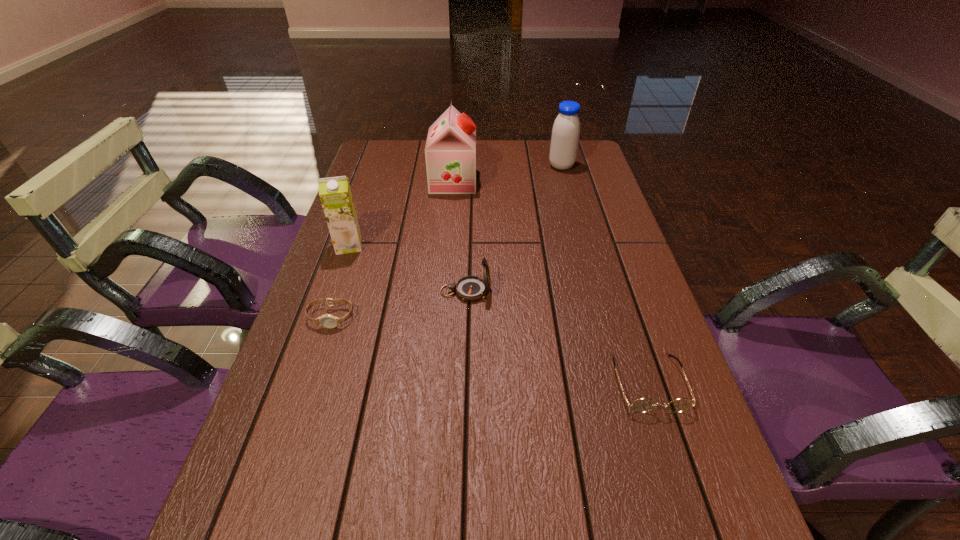
Locate an element on the screen. the second soya milk from left to right is located at coordinates (450, 152).

The image size is (960, 540). I want to click on the rightmost soya milk, so click(566, 129).

Identify the location of the leftmost soya milk. Image resolution: width=960 pixels, height=540 pixels. (335, 194).

Identify the location of the third farthest object. This screenshot has width=960, height=540. (335, 194).

This screenshot has height=540, width=960. What are the coordinates of `the third shortest object` in the screenshot? It's located at (469, 288).

The height and width of the screenshot is (540, 960). What are the coordinates of `the third nearest object` in the screenshot? It's located at click(x=469, y=288).

Where is `the nearest object`? Image resolution: width=960 pixels, height=540 pixels. the nearest object is located at coordinates (642, 405).

This screenshot has height=540, width=960. Find the location of `watch`. watch is located at coordinates (328, 321).

Identify the location of vacant region located with the cap open on the second soya milk from right to left. (542, 181).

Where is `free space located on the left of the rightmost soya milk`? The height and width of the screenshot is (540, 960). free space located on the left of the rightmost soya milk is located at coordinates (521, 166).